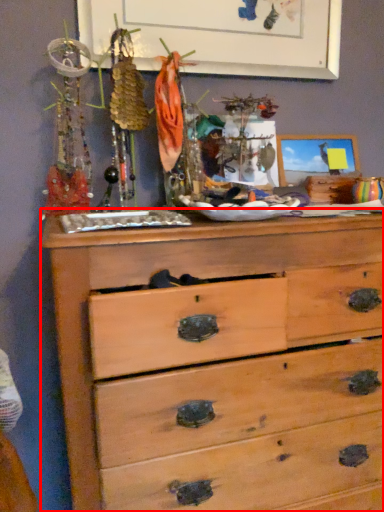
Question: From the image's perspective, what is the correct spatial relationship of chest of drawers (annotated by the red box) in relation to bulletin board?

Choices:
 (A) above
 (B) below

Answer: (B)